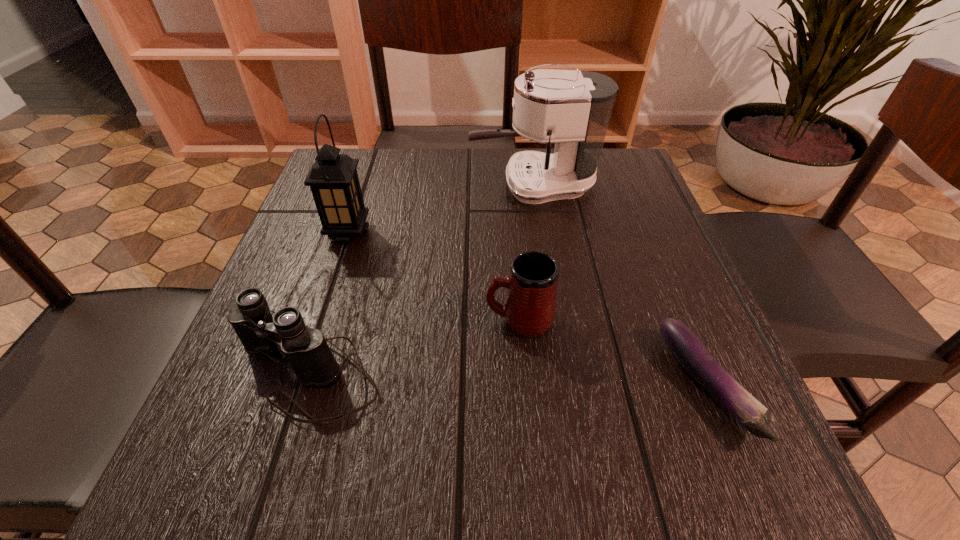
The image size is (960, 540). In order to click on free spot between the fourth nearest object and the binoculars in this screenshot , I will do `click(327, 303)`.

You are a GUI agent. You are given a task and a screenshot of the screen. Output one action in this format:
    pyautogui.click(x=<x>, y=<y>)
    Task: Click on the free area in between the lantern and the mug
    
    Given the screenshot: What is the action you would take?
    pyautogui.click(x=434, y=276)

Find the location of a particular element. This screenshot has height=540, width=960. free space between the fourth nearest object and the mug is located at coordinates (434, 276).

The image size is (960, 540). What are the coordinates of `vacant point located between the coffee maker and the binoculars` in the screenshot? It's located at (420, 279).

This screenshot has width=960, height=540. In order to click on unoccupied position between the mug and the lantern in this screenshot , I will do `click(434, 276)`.

You are a GUI agent. You are given a task and a screenshot of the screen. Output one action in this format:
    pyautogui.click(x=<x>, y=<y>)
    Task: Click on the vacant space that is in between the second farthest object and the coffee maker
    This screenshot has width=960, height=540.
    Given the screenshot: What is the action you would take?
    pyautogui.click(x=441, y=209)

Select which object is the third closest to the binoculars. Please provide its 2D coordinates. Your answer should be formatted as a tuple, i.e. [(x, y)], where the tuple contains the x and y coordinates of a point satisfying the conditions above.

[(571, 108)]

Select which object is the fourth closest to the binoculars. Please provide its 2D coordinates. Your answer should be formatted as a tuple, i.e. [(x, y)], where the tuple contains the x and y coordinates of a point satisfying the conditions above.

[(690, 352)]

This screenshot has height=540, width=960. I want to click on vacant space that satisfies the following two spatial constraints: 1. on the front-facing side of the coffee maker; 2. on the back side of the rightmost object, so click(x=564, y=386).

The width and height of the screenshot is (960, 540). Identify the location of free space that satisfies the following two spatial constraints: 1. on the front-facing side of the coffee maker; 2. on the front side of the binoculars. (562, 373).